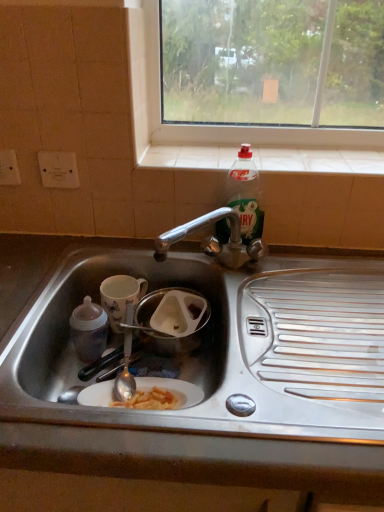
Question: From their relative heights in the image, would you say white tile at upper center is taller or shorter than translucent plastic bottle at upper right?

Choices:
 (A) tall
 (B) short

Answer: (B)

Question: In terms of size, does white tile at upper center appear bigger or smaller than translucent plastic bottle at upper right?

Choices:
 (A) small
 (B) big

Answer: (A)

Question: Which of these objects is positioned farthest from the stainless steel sink at lower left?

Choices:
 (A) white tile at upper center
 (B) translucent plastic bottle at upper right
 (C) porcelain floral mug at sink, which ranks as the first coffee cup in back-to-front order
 (D) matte ceramic coffee cup at left, which is the 1th coffee cup from front to back

Answer: (A)

Question: Considering the real-world distances, which object is farthest from the white tile at upper center?

Choices:
 (A) matte ceramic coffee cup at left, which is the 1th coffee cup from front to back
 (B) stainless steel sink at lower left
 (C) translucent plastic bottle at upper right
 (D) porcelain floral mug at sink, the 2th coffee cup when ordered from front to back

Answer: (A)